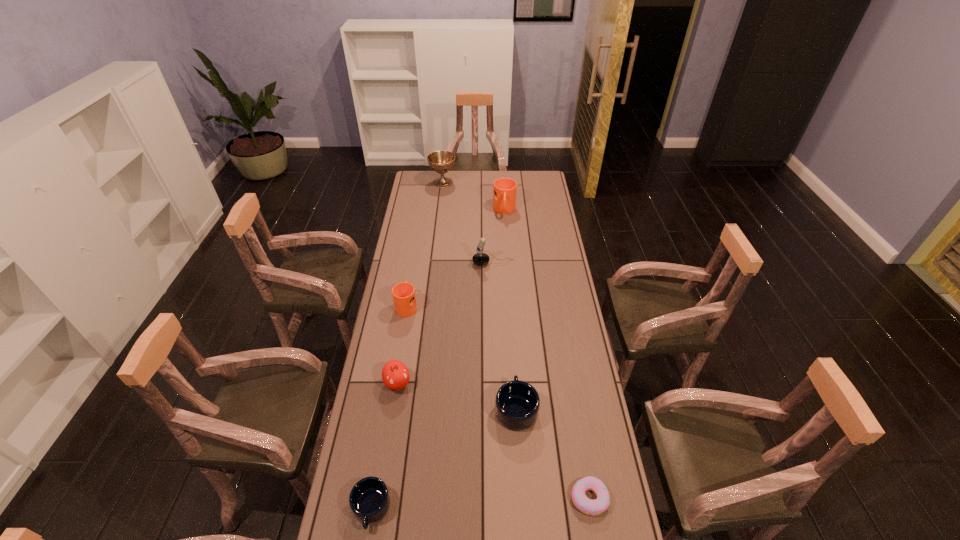
At what (x,y) coordinates should I click in order to perform the action: click on free spot located 0.300m on the handle side of the left orange mug. Please return your answer as a coordinate pair (x, y). The image size is (960, 540). Looking at the image, I should click on (416, 251).

The width and height of the screenshot is (960, 540). In order to click on free spot located 0.350m on the back of the apple in this screenshot , I will do `click(410, 303)`.

At what (x,y) coordinates should I click in order to perform the action: click on vacant area situated 0.390m with the handle on the side of the bigger blue mug. Please return your answer as a coordinate pair (x, y). Image resolution: width=960 pixels, height=540 pixels. Looking at the image, I should click on (510, 307).

I want to click on free space located 0.070m with the handle on the side of the bigger blue mug, so [514, 370].

The width and height of the screenshot is (960, 540). In order to click on free space located 0.230m with the handle on the side of the bigger blue mug in this screenshot , I will do `click(512, 336)`.

At what (x,y) coordinates should I click in order to perform the action: click on vacant space positioned 0.310m on the back of the rightmost object. Please return your answer as a coordinate pair (x, y). The width and height of the screenshot is (960, 540). Looking at the image, I should click on click(x=571, y=392).

You are a GUI agent. You are given a task and a screenshot of the screen. Output one action in this format:
    pyautogui.click(x=<x>, y=<y>)
    Task: Click on the object positioned at the far edge
    The height and width of the screenshot is (540, 960).
    Given the screenshot: What is the action you would take?
    pyautogui.click(x=440, y=161)

Where is `chalice present at the left edge`? chalice present at the left edge is located at coordinates (440, 161).

What are the coordinates of `apple located at the left edge` in the screenshot? It's located at (395, 375).

At what (x,y) coordinates should I click in order to perform the action: click on object that is at the right edge. Please return your answer as a coordinate pair (x, y). The width and height of the screenshot is (960, 540). Looking at the image, I should click on (588, 506).